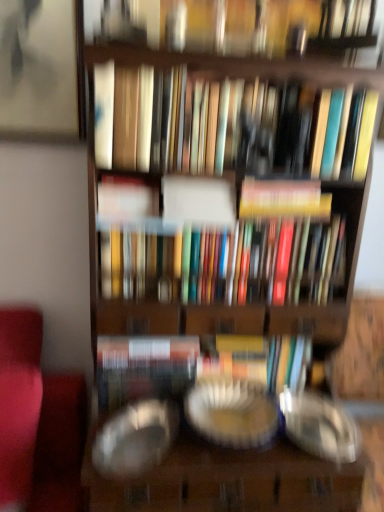
Question: Considering the positions of transparent glass plate at center, the 1th glass plate viewed from the left, and transparent glass plate at center, the first glass plate positioned from the right, in the image, is transparent glass plate at center, the 1th glass plate viewed from the left, bigger or smaller than transparent glass plate at center, the first glass plate positioned from the right,?

Choices:
 (A) small
 (B) big

Answer: (A)

Question: In terms of height, does transparent glass plate at center, which ranks as the second glass plate in right-to-left order, look taller or shorter compared to transparent glass plate at center, positioned as the second glass plate in left-to-right order?

Choices:
 (A) tall
 (B) short

Answer: (B)

Question: Which of these objects is positioned farthest from the hardcover book at center, positioned as the second book in bottom-to-top order?

Choices:
 (A) multicolored hardcover books at center, arranged as the first book when ordered from the bottom
 (B) matte hardcover books at center, which appears as the fourth book when ordered from the bottom
 (C) transparent glass plate at center, the first glass plate positioned from the right
 (D) transparent glass plate at center, which ranks as the second glass plate in right-to-left order
 (E) matte hardcover book at center

Answer: (D)

Question: Considering the real-world distances, which object is closest to the matte hardcover books at center, which appears as the fourth book when ordered from the bottom?

Choices:
 (A) matte white book at center, which is the third book from bottom to top
 (B) transparent glass plate at center, positioned as the second glass plate in left-to-right order
 (C) hardcover book at center, marked as the third book in a top-to-bottom arrangement
 (D) multicolored hardcover books at center, arranged as the first book when ordered from the bottom
 (E) transparent glass plate at center, the 1th glass plate viewed from the left

Answer: (C)